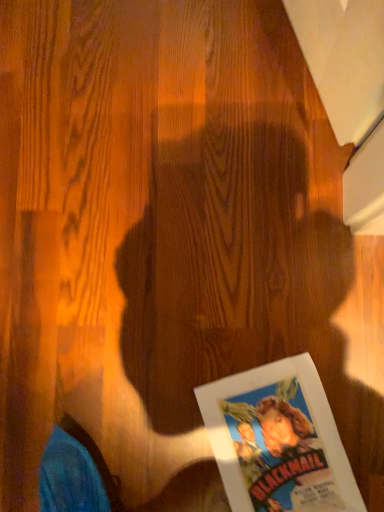
The image size is (384, 512). Identify the location of free space above matte paper movie poster at lower right (from a real-world perspective). (279, 449).